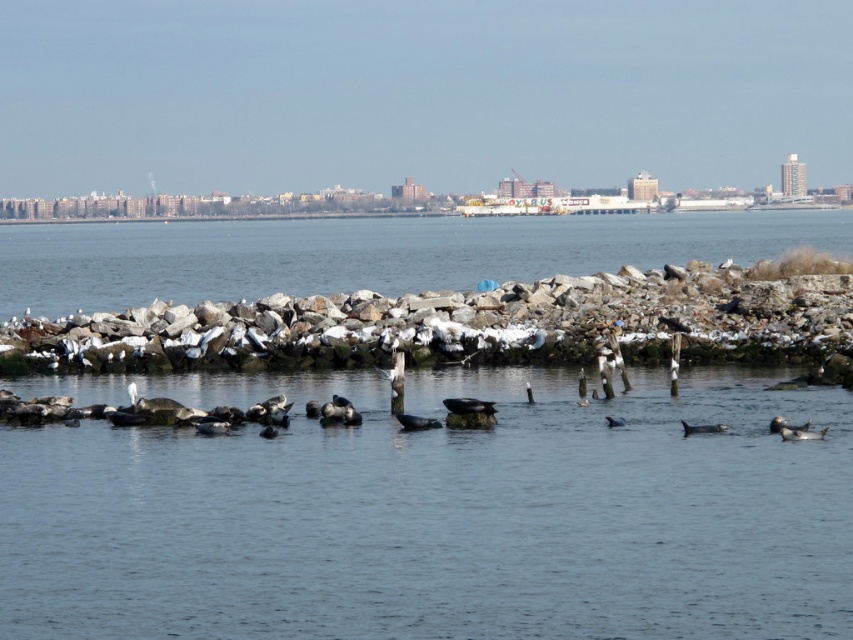
Between grayish-blue water at center and clear water at center, which one is positioned lower?

grayish-blue water at center is below.

Is grayish-blue water at center to the right of clear water at center from the viewer's perspective?

Yes, grayish-blue water at center is to the right of clear water at center.

Is point (717, 435) closer to viewer compared to point (180, 246)?

Yes, it is.

You are a GUI agent. You are given a task and a screenshot of the screen. Output one action in this format:
    pyautogui.click(x=<x>, y=<y>)
    Task: Click on the grayish-blue water at center
    This screenshot has height=640, width=853.
    Given the screenshot: What is the action you would take?
    pyautogui.click(x=432, y=513)